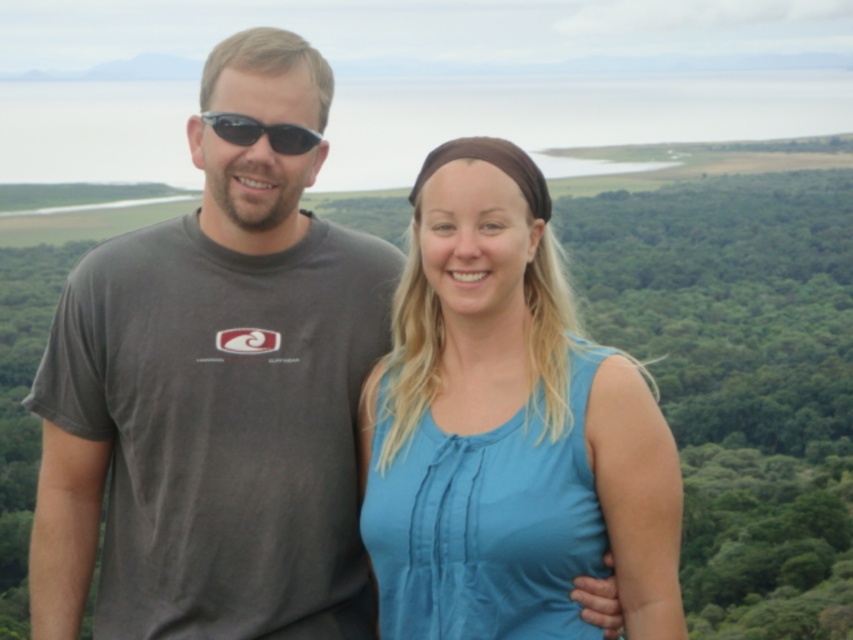
Does point (502, 262) come in front of point (286, 131)?

No, it is not.

Who is more forward, (515, 189) or (274, 125)?

Point (274, 125) is more forward.

What are the coordinates of `blue cotton shirt at right` in the screenshot? It's located at (509, 397).